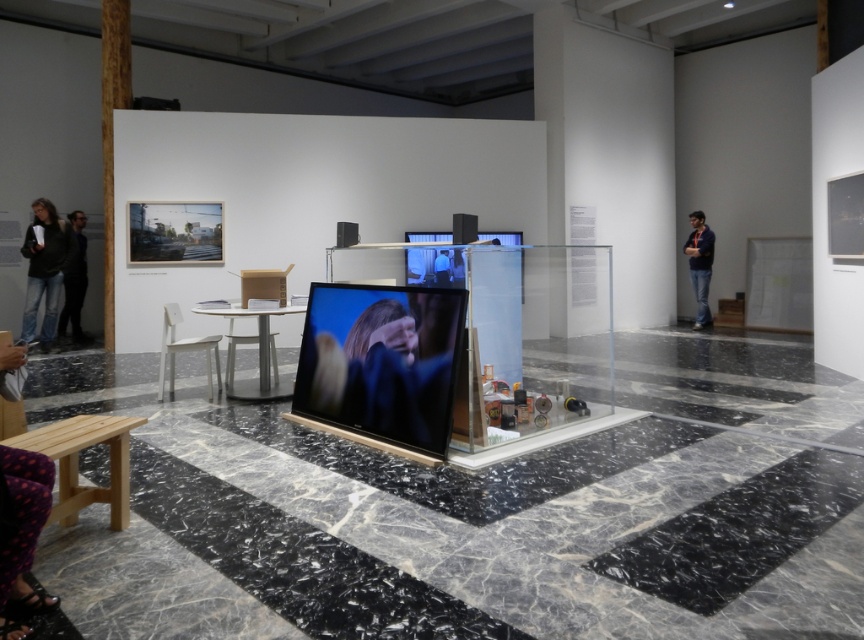
You are standing in the art gallery and see the point marked at coordinates (x=43, y=269). According to the scene description, where exactly is this point located?

The point marked at coordinates (x=43, y=269) is located on the jeans at left.

You are a visitor in the art gallery and want to take a photo of both the jeans at left and the dark blue shirt at right. However, you notice that one of them is much taller than the other. Which one should you focus on first to ensure both are in frame?

The jeans at left is much taller than the dark blue shirt at right, so you should focus on the jeans at left first to ensure both are in frame since it occupies more vertical space.

You are an art enthusiast standing in the center of the gallery. You notice the jeans at left. Based on their position, can you determine if they are placed to the left or right of the glass display case?

The jeans at left are located at point (43,269), which is to the left of the glass display case.